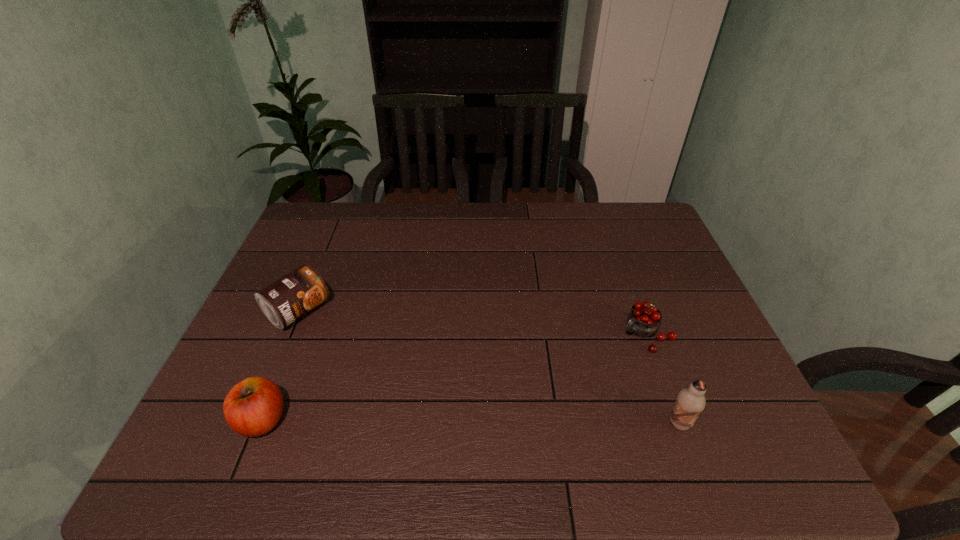
Locate an element on the screen. free space on the desktop that is between the apple and the chocolate milk and is positioned on the front label of the can is located at coordinates (444, 421).

I want to click on vacant space on the desktop that is between the apple and the tallest object and is positioned on the handle side of the pot filled with cherries, so click(x=532, y=422).